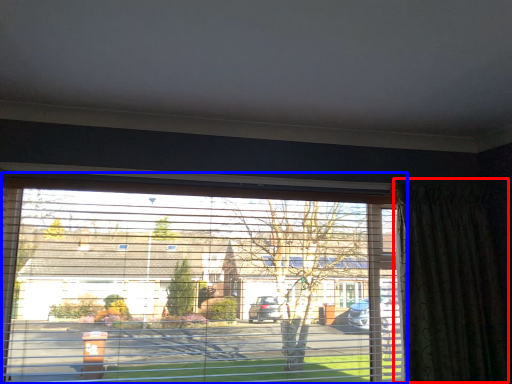
Question: Among these objects, which one is farthest to the camera, curtain (highlighted by a red box) or window (highlighted by a blue box)?

Choices:
 (A) curtain
 (B) window

Answer: (A)